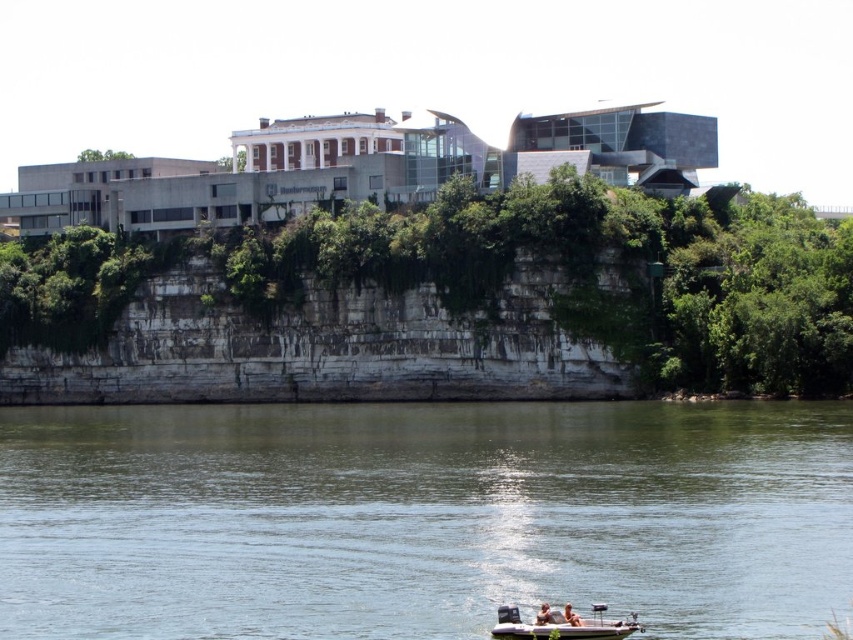
You are standing on the riverside and see two boats at the lower center of the scene. Which boat is closer to you, the white plastic boat at lower center or the light brown wooden boat at lower center?

The white plastic boat at lower center is closer to you because it is in front of the light brown wooden boat at lower center.

You are standing on the riverside and want to cross the river using the white plastic boat at lower center. The greenish water at lower center is flowing from left to right. If the boat is placed in the middle of the river, will it drift towards the left or right bank?

The greenish water at lower center is wider than the white plastic boat at lower center, so the boat will drift towards the right bank as the current flows from left to right.

You are standing at the riverside and want to reach a specific point marked at coordinates point (146,422). If your maximum walking distance is 400 feet, will you be able to reach it without exceeding your limit?

The distance of point (146,422) from viewer is 412.59 feet, which exceeds your maximum walking distance of 400 feet. Therefore, you will not be able to reach it without exceeding your limit.